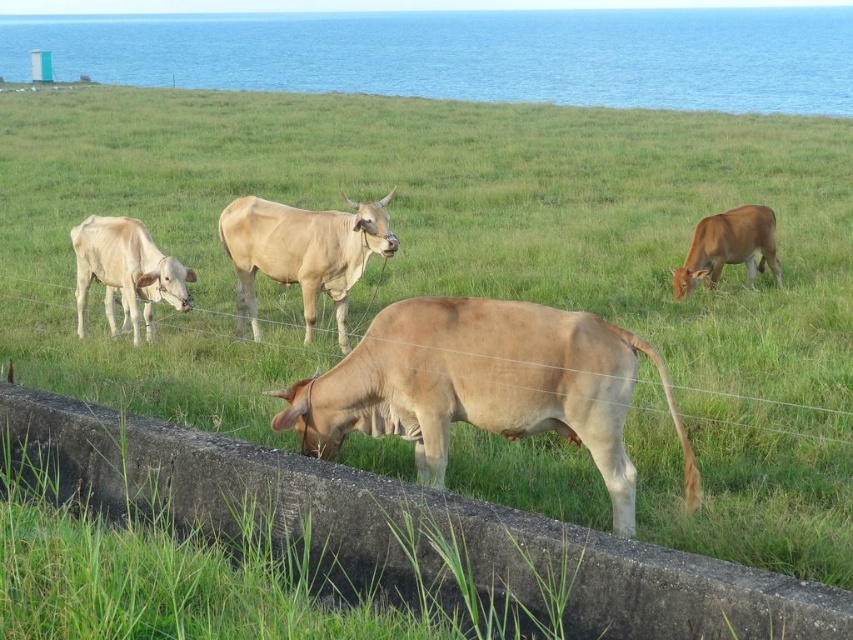
You are standing on the concrete barrier in the foreground and want to observe the blue water at upper center and the light brown cow at center. Which object is higher in the image?

The blue water at upper center is positioned over the light brown cow at center, so it is higher in the image.

You are standing at the concrete barrier and looking towards the light brown smooth cow at center. Is the blue water at upper center closer to you or farther away than the cow?

The blue water at upper center is closer to you than the light brown smooth cow at center because it is further to the viewer according to the description.

You are standing near the concrete barrier and want to approach both the light beige cow at left and the light brown cow at right. Which cow will you reach first?

You will reach the light beige cow at left first because it is closer to the viewer than the light brown cow at right.